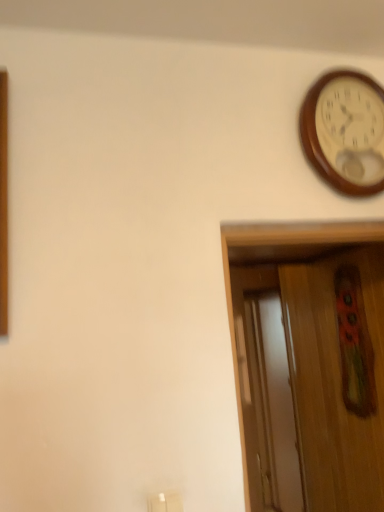
Question: Should I look upward or downward to see wooden/polished wall clock at upper right?

Choices:
 (A) down
 (B) up

Answer: (B)